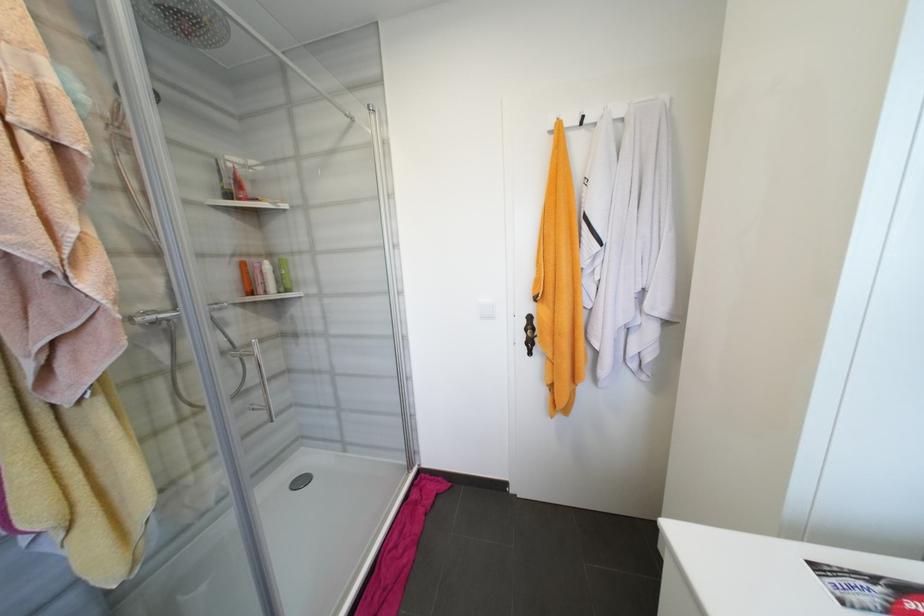
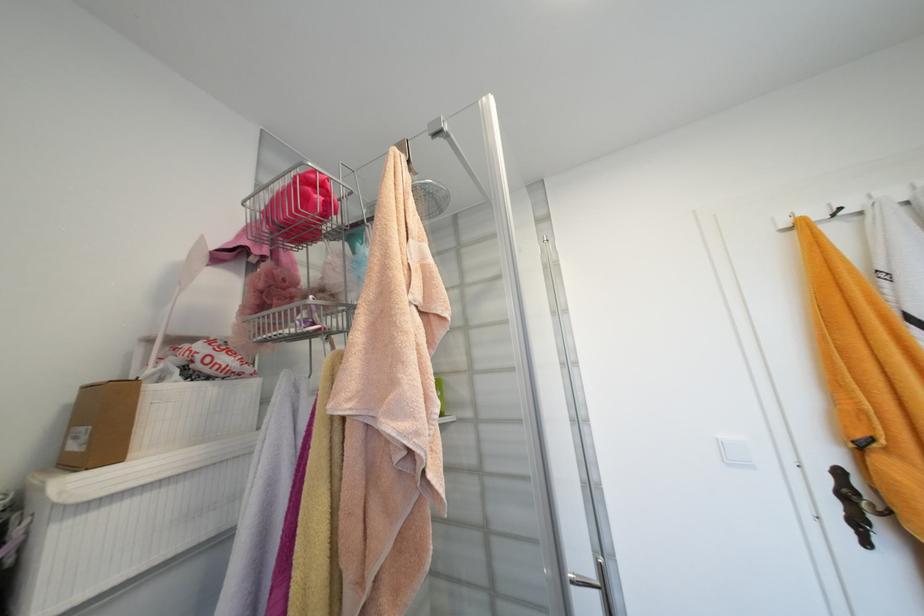
The point at (615, 105) is marked in the first image. Where is the corresponding point in the second image?

(885, 193)